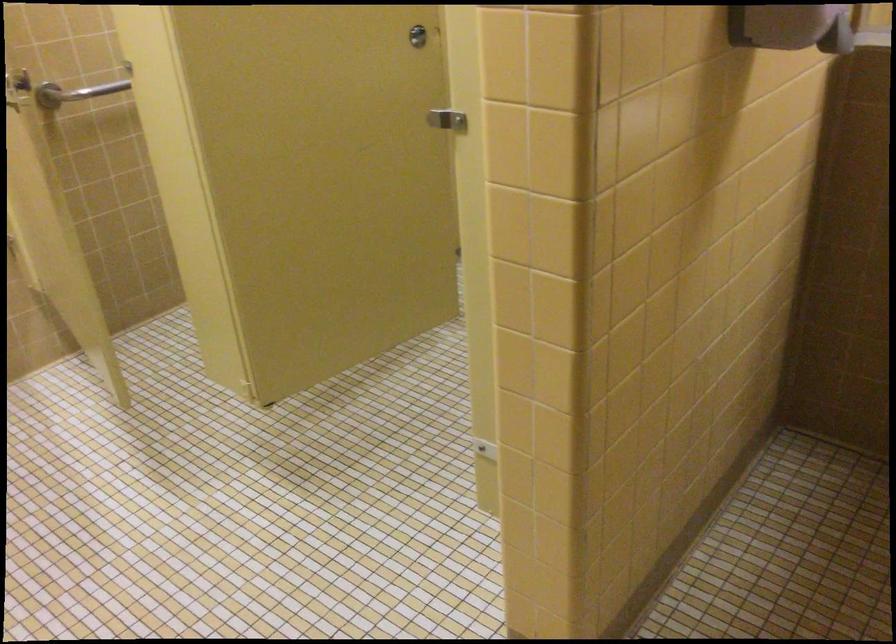
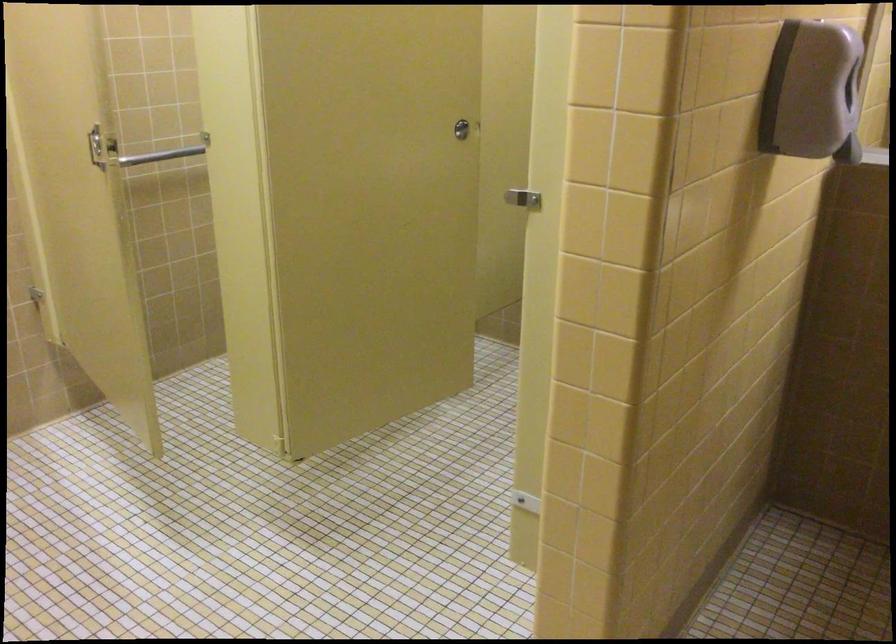
Question: How did the camera likely rotate?

Choices:
 (A) Left
 (B) Right
 (C) Up
 (D) Down

Answer: (C)